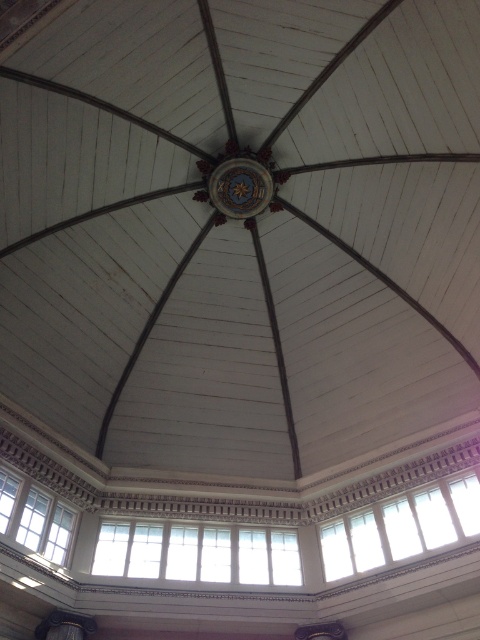
You are an architect analyzing the structural integrity of the ceiling. The central circular design has a diameter of 2 meters. The white glass windows at center are located at coordinates point 0.866, 0.412. Are the windows positioned at the exact center of the ceiling?

The white glass windows at center are located at coordinates point (197, 554), which is not exactly at the center of the ceiling. The exact center would be at coordinates (240, 320), so the windows are offset to the right and slightly downward from the true center.

You are an architect designing a new structure inspired by this historical building. You need to ensure that the central feature of your design includes both the white glass windows at center and the gold metallic clock at center. Which object should be placed in a larger size to maintain the original proportions?

The white glass windows at center should be placed in a larger size than the gold metallic clock at center to maintain the original proportions, as the white glass windows at center is bigger than the gold metallic clock at center in the original design.

You are standing inside a historical building with a radial beam ceiling. You notice a point marked at coordinates (400, 528). What object is located at this point?

The point at coordinates (400, 528) marks the white glass window at lower center.